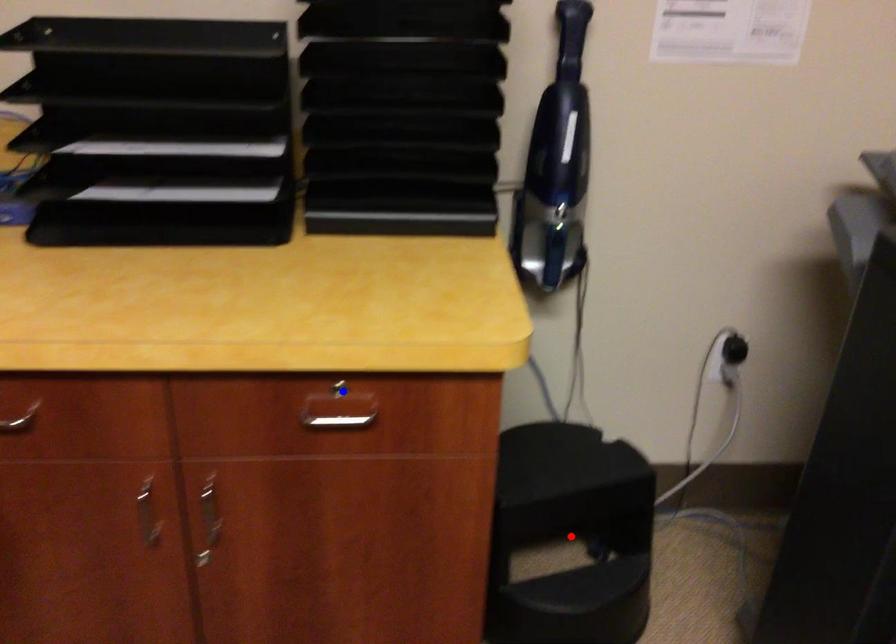
Question: Two points are marked on the image. Which point is closer to the camera?

Choices:
 (A) Blue point is closer.
 (B) Red point is closer.

Answer: (A)